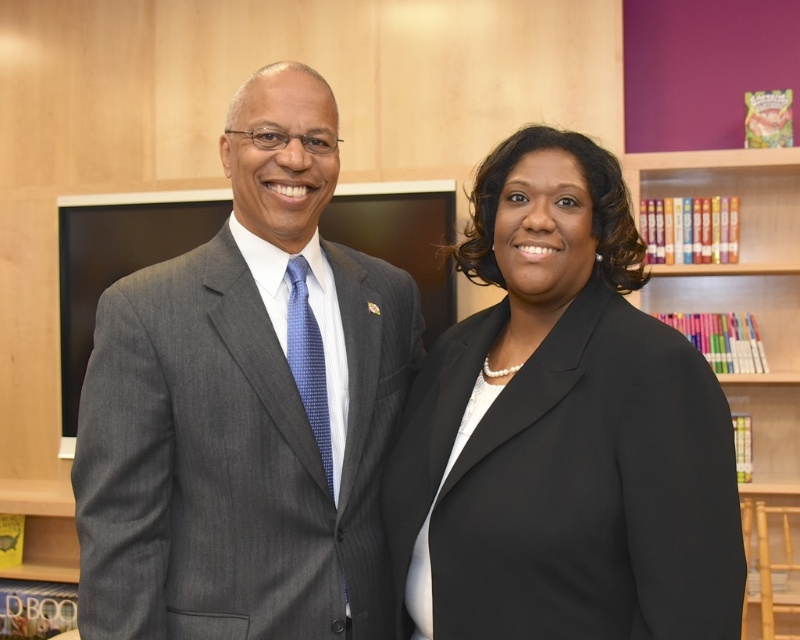
You are standing in the library and need to determine the exact position of the matte gray suit at left relative to the bookshelves in the background. Can you identify its coordinates based on the image?

The matte gray suit at left is located at point coordinates of (246, 406).

You are a photographer setting up a photo shoot in a library. You have two subjects wearing the matte gray suit at left and the black satin blazer at center. You want to ensure that the wider subject is positioned closer to the camera to maintain visual balance. Which subject should you place closer to the camera?

The matte gray suit at left is wider than the black satin blazer at center, so you should place the matte gray suit at left closer to the camera to maintain visual balance.

You are a tailor trying to determine if the black satin blazer at center can fit into a storage box designed for books. The box is currently filled with multicolored paperbacks at upper right. Based on their thickness, will the blazer fit in the box?

The black satin blazer at center is thinner than the multicolored paperbacks at upper right, so it should fit into the box designed for those books.